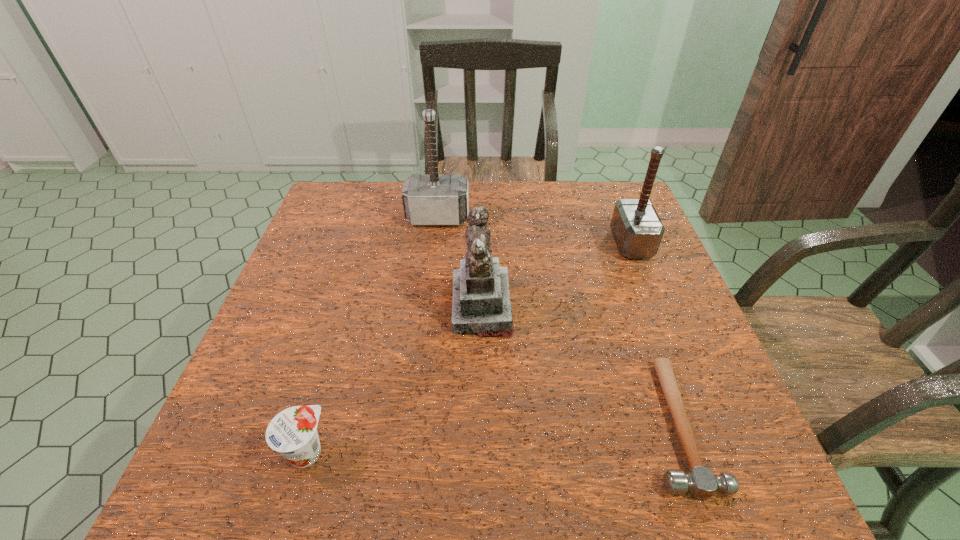
Image resolution: width=960 pixels, height=540 pixels. I want to click on vacant space at the far left corner, so click(x=331, y=182).

Identify the location of vacant region at the near left corner of the desktop. The width and height of the screenshot is (960, 540). (249, 486).

This screenshot has height=540, width=960. In order to click on free space between the figurine and the fourth tallest object in this screenshot , I will do `click(394, 380)`.

This screenshot has height=540, width=960. What are the coordinates of `vacant point located between the leftmost hammer and the nearest hammer` in the screenshot? It's located at (557, 321).

Where is `vacant area that lies between the third farthest object and the nearest hammer`? This screenshot has height=540, width=960. vacant area that lies between the third farthest object and the nearest hammer is located at coordinates (579, 365).

Locate an element on the screen. The image size is (960, 540). empty space between the leftmost hammer and the shortest object is located at coordinates (557, 321).

Locate an element on the screen. The image size is (960, 540). vacant area that lies between the shortest hammer and the leftmost hammer is located at coordinates (557, 321).

The width and height of the screenshot is (960, 540). I want to click on vacant area between the shortest object and the third nearest object, so click(x=579, y=365).

Select which object appears as the fourth closest to the nearest hammer. Please provide its 2D coordinates. Your answer should be formatted as a tuple, i.e. [(x, y)], where the tuple contains the x and y coordinates of a point satisfying the conditions above.

[(437, 199)]

Image resolution: width=960 pixels, height=540 pixels. In order to click on object that is the second nearest to the fourth tallest object in this screenshot , I will do `click(700, 481)`.